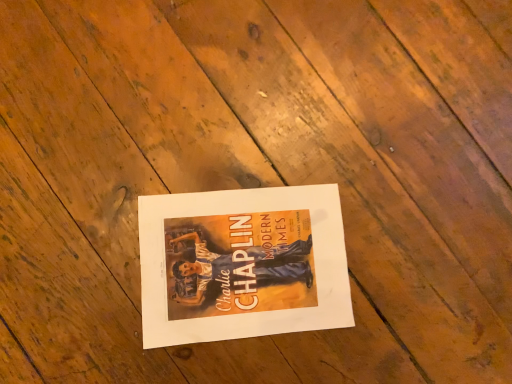
Where is `vacant area to the left of matte paper poster at center`? vacant area to the left of matte paper poster at center is located at coordinates (x=117, y=167).